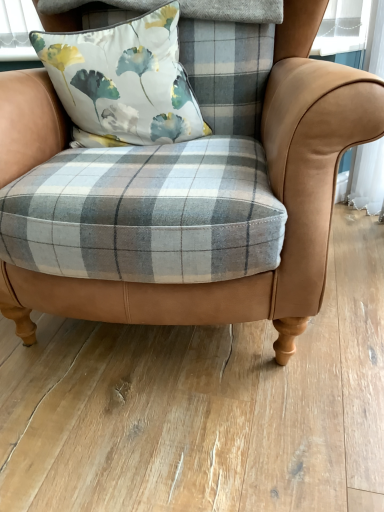
Question: Is floral fabric cushion at upper center facing towards matte plaid fabric chair at center?

Choices:
 (A) no
 (B) yes

Answer: (B)

Question: Can you confirm if floral fabric cushion at upper center is bigger than matte plaid fabric chair at center?

Choices:
 (A) no
 (B) yes

Answer: (A)

Question: Is floral fabric cushion at upper center outside matte plaid fabric chair at center?

Choices:
 (A) yes
 (B) no

Answer: (B)

Question: From a real-world perspective, is floral fabric cushion at upper center physically above matte plaid fabric chair at center?

Choices:
 (A) no
 (B) yes

Answer: (B)

Question: Is floral fabric cushion at upper center at the right side of matte plaid fabric chair at center?

Choices:
 (A) yes
 (B) no

Answer: (B)

Question: Can you confirm if floral fabric cushion at upper center is taller than matte plaid fabric chair at center?

Choices:
 (A) no
 (B) yes

Answer: (A)

Question: From a real-world perspective, is matte plaid fabric chair at center positioned under floral fabric cushion at upper center based on gravity?

Choices:
 (A) no
 (B) yes

Answer: (B)

Question: Is matte plaid fabric chair at center taller than floral fabric cushion at upper center?

Choices:
 (A) yes
 (B) no

Answer: (A)

Question: Does matte plaid fabric chair at center come behind floral fabric cushion at upper center?

Choices:
 (A) no
 (B) yes

Answer: (A)

Question: From the image's perspective, does matte plaid fabric chair at center appear higher than floral fabric cushion at upper center?

Choices:
 (A) no
 (B) yes

Answer: (A)

Question: Is the surface of matte plaid fabric chair at center in direct contact with floral fabric cushion at upper center?

Choices:
 (A) yes
 (B) no

Answer: (B)

Question: Considering the relative sizes of matte plaid fabric chair at center and floral fabric cushion at upper center in the image provided, is matte plaid fabric chair at center bigger than floral fabric cushion at upper center?

Choices:
 (A) no
 (B) yes

Answer: (B)

Question: Considering the relative positions of floral fabric cushion at upper center and matte plaid fabric chair at center in the image provided, is floral fabric cushion at upper center to the left or to the right of matte plaid fabric chair at center?

Choices:
 (A) right
 (B) left

Answer: (B)